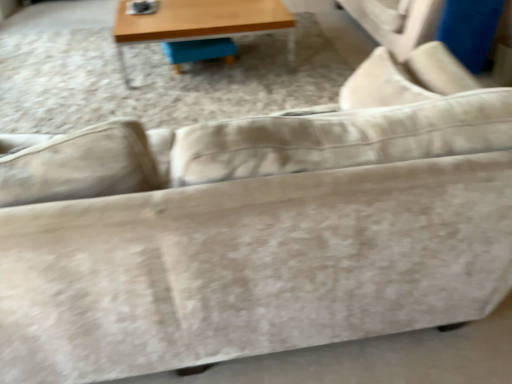
Identify the location of free space in front of wooden table at upper center. The height and width of the screenshot is (384, 512). (191, 97).